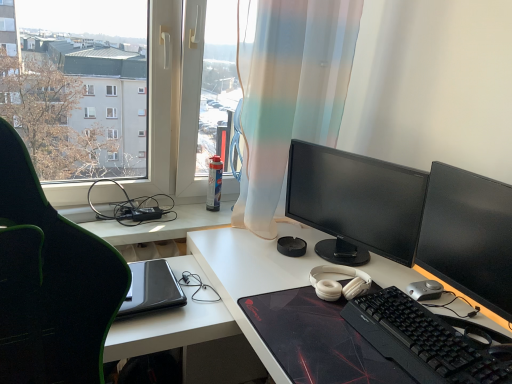
Where is `free space between white matte headphones at center and black textured mousepad at center`? free space between white matte headphones at center and black textured mousepad at center is located at coordinates (285, 278).